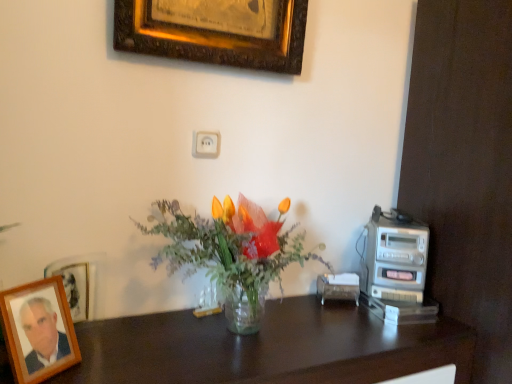
Question: Is dark wood desk at center inside or outside of transparent glass vase at center?

Choices:
 (A) inside
 (B) outside

Answer: (B)

Question: From a real-world perspective, relative to transparent glass vase at center, is dark wood desk at center vertically above or below?

Choices:
 (A) below
 (B) above

Answer: (A)

Question: Based on their relative distances, which object is nearer to the wooden photo frame at lower left, acting as the first picture frame starting from the front?

Choices:
 (A) dark wood desk at center
 (B) silver metallic stereo at right
 (C) white plastic outlet at upper center
 (D) gold-framed picture at upper center, which appears as the second picture frame when viewed from the left
 (E) transparent glass vase at center

Answer: (A)

Question: Which object is positioned closest to the wooden photo frame at lower left, acting as the first picture frame starting from the front?

Choices:
 (A) dark wood desk at center
 (B) silver metallic stereo at right
 (C) white plastic outlet at upper center
 (D) transparent glass vase at center
 (E) gold-framed picture at upper center, which appears as the second picture frame when viewed from the left

Answer: (A)